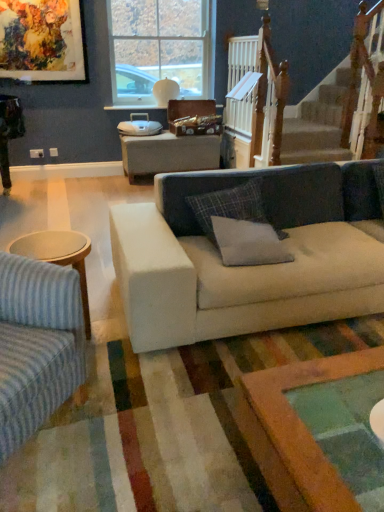
Question: Which direction should I rotate to look at gray fabric pillow at center, which ranks as the 2th pillow in top-to-bottom order?

Choices:
 (A) left
 (B) right

Answer: (B)

Question: From the image's perspective, does plaid fabric pillow at center, which is counted as the 2th pillow, starting from the bottom, appear higher than beige fabric couch at center, which appears as the 1th studio couch when viewed from the right?

Choices:
 (A) no
 (B) yes

Answer: (B)

Question: Considering the relative sizes of plaid fabric pillow at center, which is counted as the 2th pillow, starting from the bottom, and beige fabric couch at center, placed as the second studio couch when sorted from left to right, in the image provided, is plaid fabric pillow at center, which is counted as the 2th pillow, starting from the bottom, shorter than beige fabric couch at center, placed as the second studio couch when sorted from left to right,?

Choices:
 (A) yes
 (B) no

Answer: (A)

Question: Could you tell me if plaid fabric pillow at center, which is counted as the 2th pillow, starting from the bottom, is facing beige fabric couch at center, which appears as the 1th studio couch when viewed from the right?

Choices:
 (A) yes
 (B) no

Answer: (A)

Question: Are plaid fabric pillow at center, which is the 1th pillow from top to bottom, and beige fabric couch at center, which appears as the 1th studio couch when viewed from the right, making contact?

Choices:
 (A) yes
 (B) no

Answer: (B)

Question: Considering the relative positions of plaid fabric pillow at center, which is counted as the 2th pillow, starting from the bottom, and beige fabric couch at center, which appears as the 1th studio couch when viewed from the right, in the image provided, is plaid fabric pillow at center, which is counted as the 2th pillow, starting from the bottom, to the right of beige fabric couch at center, which appears as the 1th studio couch when viewed from the right, from the viewer's perspective?

Choices:
 (A) yes
 (B) no

Answer: (B)

Question: Is plaid fabric pillow at center, which is the 1th pillow from top to bottom, bigger than beige fabric couch at center, placed as the second studio couch when sorted from left to right?

Choices:
 (A) yes
 (B) no

Answer: (B)

Question: From the image's perspective, is plaid fabric pillow at center, which is counted as the 2th pillow, starting from the bottom, on top of gray fabric pillow at center, which ranks as the 2th pillow in top-to-bottom order?

Choices:
 (A) yes
 (B) no

Answer: (A)

Question: From the image's perspective, would you say plaid fabric pillow at center, which is counted as the 2th pillow, starting from the bottom, is shown under gray fabric pillow at center, which ranks as the 2th pillow in top-to-bottom order?

Choices:
 (A) yes
 (B) no

Answer: (B)

Question: From a real-world perspective, is plaid fabric pillow at center, which is the 1th pillow from top to bottom, physically below gray fabric pillow at center, which ranks as the 2th pillow in top-to-bottom order?

Choices:
 (A) yes
 (B) no

Answer: (B)

Question: Is plaid fabric pillow at center, which is counted as the 2th pillow, starting from the bottom, facing away from gray fabric pillow at center, which ranks as the 2th pillow in top-to-bottom order?

Choices:
 (A) no
 (B) yes

Answer: (A)

Question: Considering the relative sizes of plaid fabric pillow at center, which is the 1th pillow from top to bottom, and gray fabric pillow at center, which ranks as the 2th pillow in top-to-bottom order, in the image provided, is plaid fabric pillow at center, which is the 1th pillow from top to bottom, shorter than gray fabric pillow at center, which ranks as the 2th pillow in top-to-bottom order,?

Choices:
 (A) no
 (B) yes

Answer: (A)

Question: Is plaid fabric pillow at center, which is counted as the 2th pillow, starting from the bottom, at the right side of gray fabric pillow at center, which ranks as the 2th pillow in top-to-bottom order?

Choices:
 (A) yes
 (B) no

Answer: (B)

Question: Considering the relative sizes of clear glass window at upper center and gray fabric pillow at center, which appears as the first pillow when ordered from the bottom, in the image provided, is clear glass window at upper center bigger than gray fabric pillow at center, which appears as the first pillow when ordered from the bottom,?

Choices:
 (A) no
 (B) yes

Answer: (B)